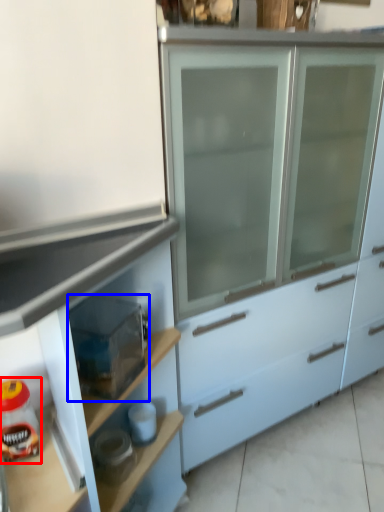
Question: Which point is closer to the camera, food (highlighted by a red box) or appliance (highlighted by a blue box)?

Choices:
 (A) food
 (B) appliance

Answer: (B)